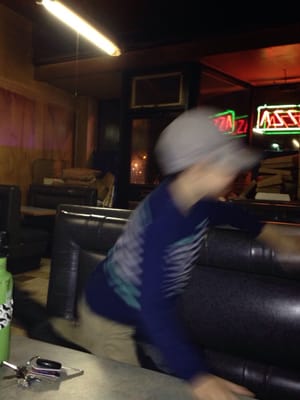
At what (x,y) coordinates should I click in order to perform the action: click on light source. Please return your answer as a coordinate pair (x, y). Looking at the image, I should click on (74, 24).